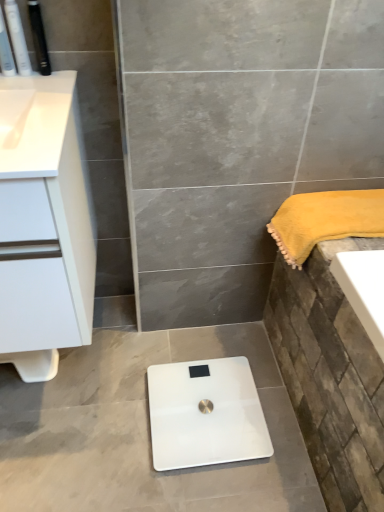
Where is `free point to the right of matte black toothbrush at upper left, the third toiletry positioned from the right`? This screenshot has height=512, width=384. free point to the right of matte black toothbrush at upper left, the third toiletry positioned from the right is located at coordinates coord(48,84).